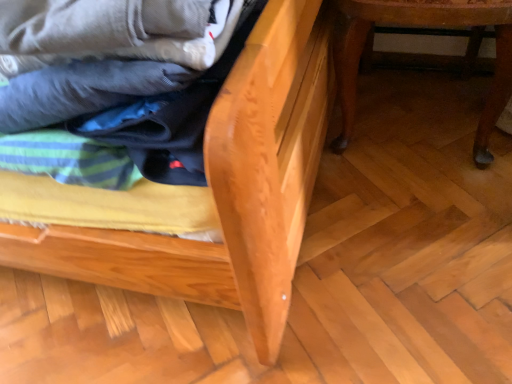
Locate an element on the screen. This screenshot has height=384, width=512. free point in front of wooden table at lower right, arranged as the 1th furniture when viewed from the right is located at coordinates (413, 230).